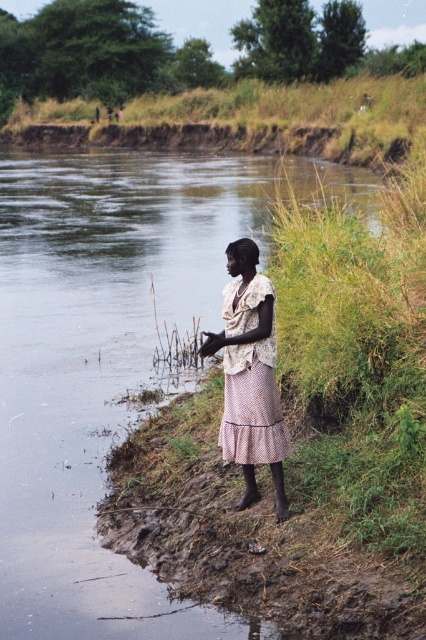
Is brown dirt at upper center to the left of pink dotted fabric dress at center from the viewer's perspective?

Correct, you'll find brown dirt at upper center to the left of pink dotted fabric dress at center.

Which is in front, point (123, 124) or point (224, 403)?

Point (224, 403) is more forward.

Find the location of a particular element. brown dirt at upper center is located at coordinates (210, 140).

Is greenish water at river left shorter than light beige lace blouse at center?

In fact, greenish water at river left may be taller than light beige lace blouse at center.

In the scene shown: Can you confirm if greenish water at river left is positioned below light beige lace blouse at center?

Actually, greenish water at river left is above light beige lace blouse at center.

Find the location of a particular element. The width and height of the screenshot is (426, 640). greenish water at river left is located at coordinates (100, 364).

Is point (62, 472) positioned in front of point (259, 285)?

No, it is not.

Which is in front, point (58, 243) or point (271, 340)?

Positioned in front is point (271, 340).

Identify the location of greenish water at river left. (100, 364).